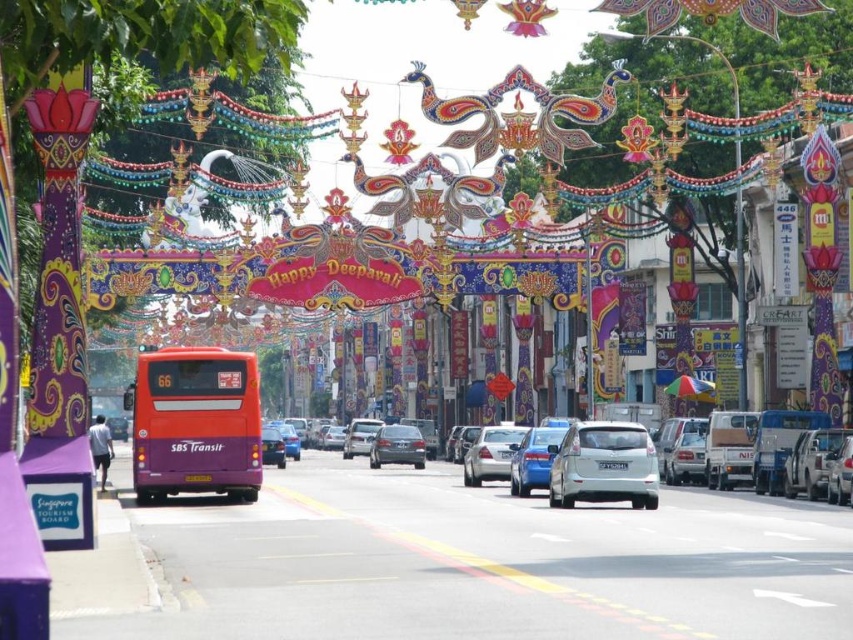
You are a pedestrian standing on the sidewalk and want to cross the street. You see a white glossy sedan at center and an orange matte bus at center. Which vehicle is closer to the ground?

The white glossy sedan at center is below orange matte bus at center, so the white glossy sedan at center is closer to the ground.

You are a delivery driver who needs to park your vehicle, which is 2 meters wide, in this street. You see a white glossy sedan at center and an orange matte bus at center. Can you determine if there is enough space between them to park your vehicle?

The white glossy sedan at center might be wider than orange matte bus at center, so the space between them may not be sufficient for a 2 meter wide vehicle. Check the actual width before attempting to park.